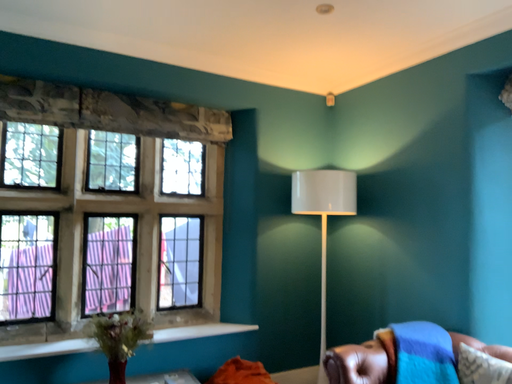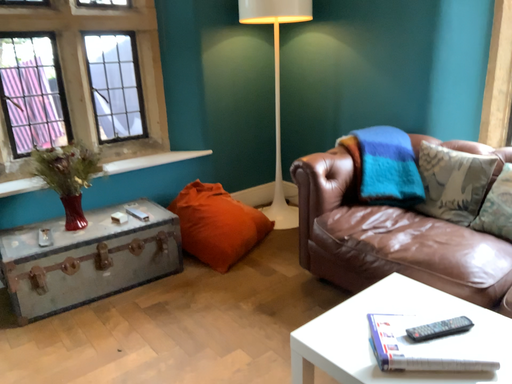
Question: How did the camera likely rotate when shooting the video?

Choices:
 (A) rotated right
 (B) rotated left

Answer: (A)